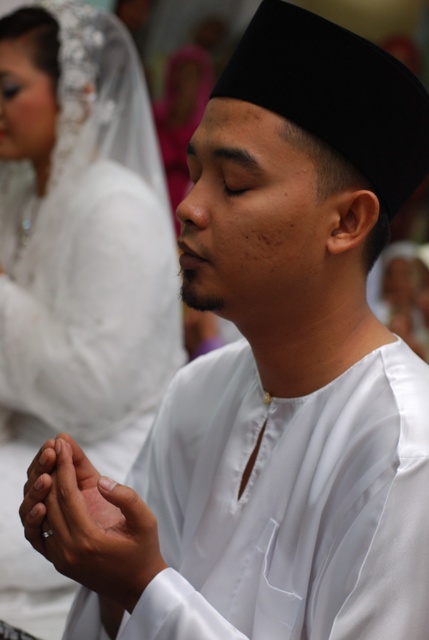
Question: Does white satin veil at upper left come in front of white satin hands at center?

Choices:
 (A) yes
 (B) no

Answer: (B)

Question: Which object is closer to the camera taking this photo?

Choices:
 (A) white satin hands at center
 (B) white satin veil at upper left

Answer: (A)

Question: Among these points, which one is farthest from the camera?

Choices:
 (A) (23, 477)
 (B) (93, 502)

Answer: (A)

Question: Is white satin veil at upper left in front of white satin hands at center?

Choices:
 (A) no
 (B) yes

Answer: (A)

Question: Does white satin veil at upper left appear under white satin hands at center?

Choices:
 (A) no
 (B) yes

Answer: (A)